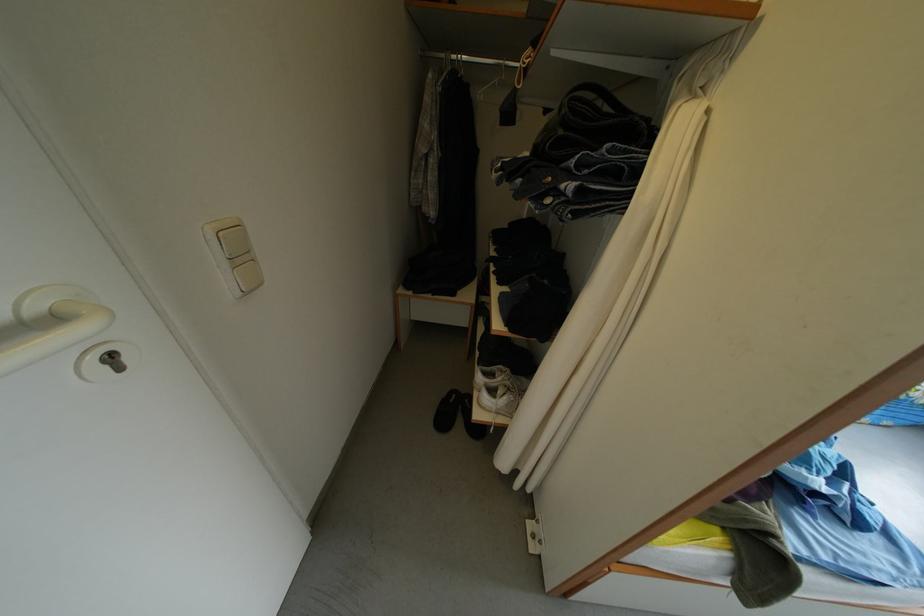
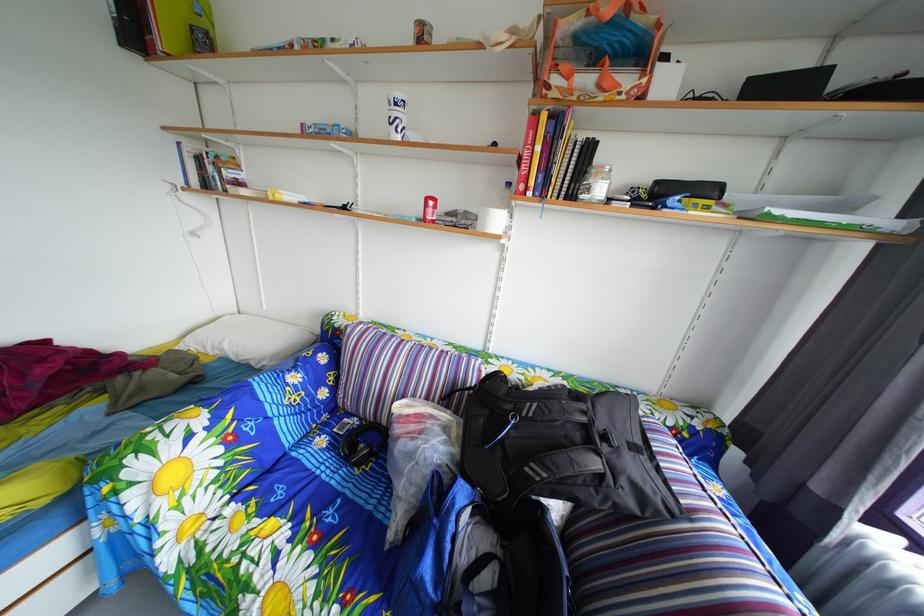
Question: What movement of the cameraman would produce the second image?

Choices:
 (A) Left
 (B) Right
 (C) Forward
 (D) Backward

Answer: (B)